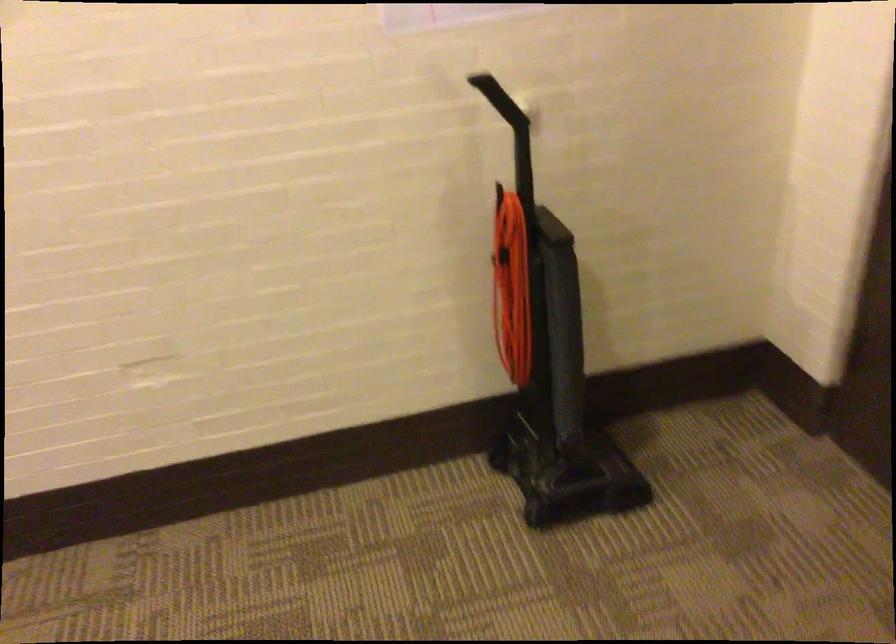
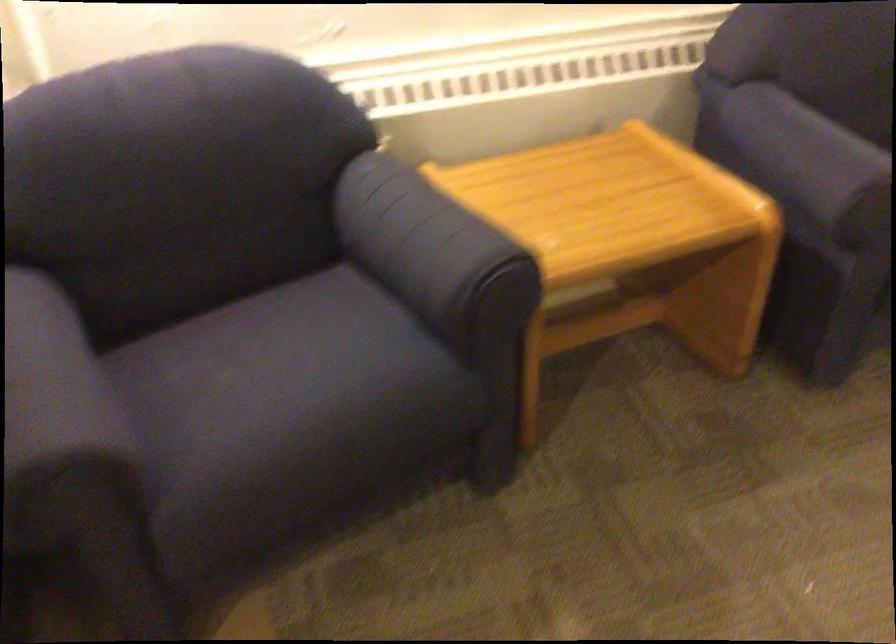
The images are taken continuously from a first-person perspective. In which direction is your viewpoint rotating?

The camera's rotation is toward right-down.